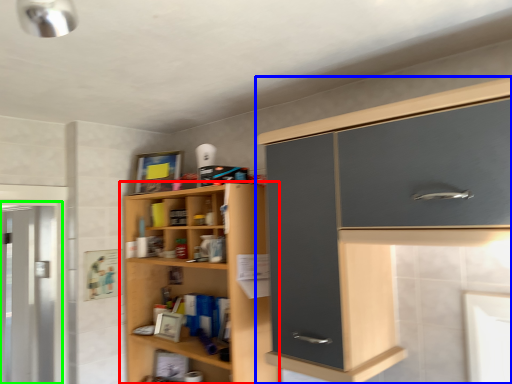
Question: Which is farther away from cupboard (highlighted by a red box)? cabinetry (highlighted by a blue box) or screen door (highlighted by a green box)?

Choices:
 (A) cabinetry
 (B) screen door

Answer: (B)